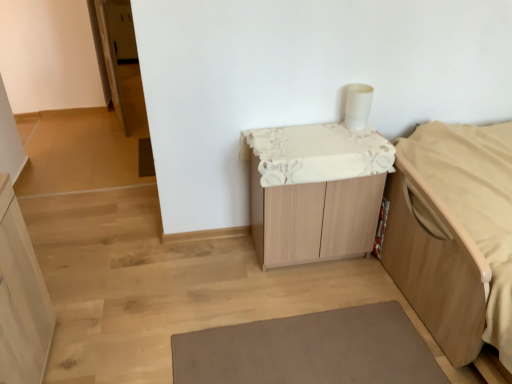
Question: Is wooden cabinet at center spatially inside gray matte bath mat at lower center, or outside of it?

Choices:
 (A) inside
 (B) outside

Answer: (B)

Question: From a real-world perspective, is wooden cabinet at center physically located above or below gray matte bath mat at lower center?

Choices:
 (A) below
 (B) above

Answer: (B)

Question: Which is farther from the light wood bed frame at right?

Choices:
 (A) gray matte bath mat at lower center
 (B) wooden cabinet at center
 (C) light wood cabinet at left

Answer: (C)

Question: Which object is the closest to the light wood bed frame at right?

Choices:
 (A) light wood cabinet at left
 (B) gray matte bath mat at lower center
 (C) wooden cabinet at center

Answer: (C)